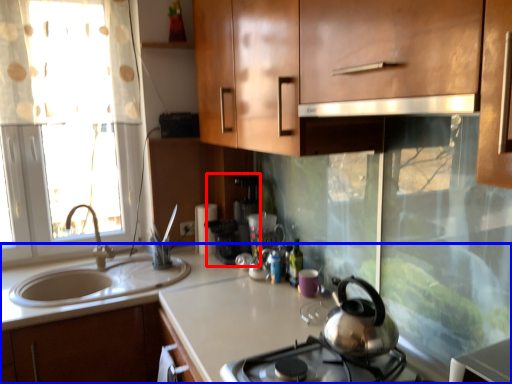
Question: Among these objects, which one is farthest to the camera, coffee machine (highlighted by a red box) or countertop (highlighted by a blue box)?

Choices:
 (A) coffee machine
 (B) countertop

Answer: (A)